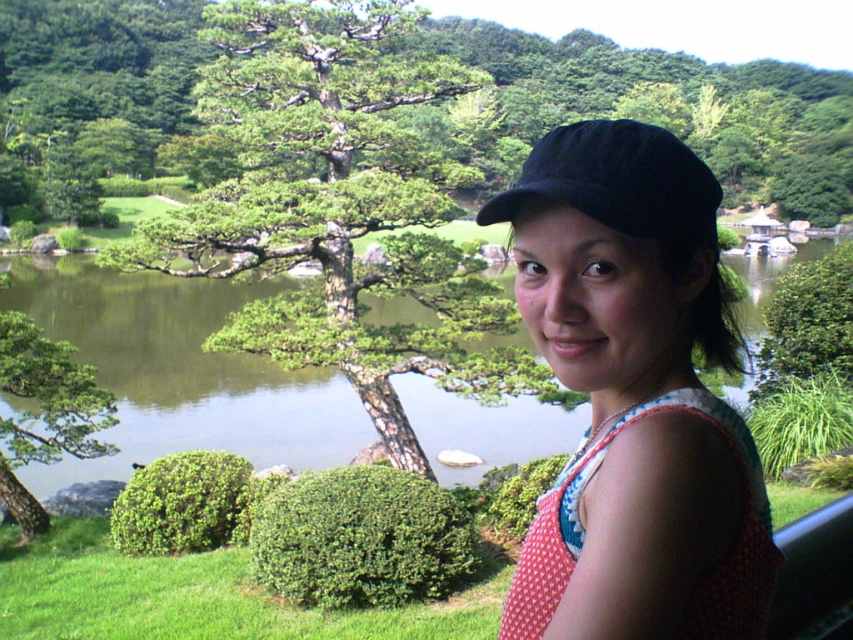
Can you confirm if matte black cap at upper right is positioned to the right of polka dot fabric apron at right?

Yes, matte black cap at upper right is to the right of polka dot fabric apron at right.

Is point (584, 520) in front of point (758, 506)?

Yes, point (584, 520) is closer to viewer.

Where is `matte black cap at upper right`? The image size is (853, 640). matte black cap at upper right is located at coordinates (634, 397).

Is matte black cap at upper right bigger than green leafy tree at center?

Incorrect, matte black cap at upper right is not larger than green leafy tree at center.

Who is shorter, matte black cap at upper right or green leafy tree at center?

matte black cap at upper right is shorter.

Who is more forward, (547,573) or (479,138)?

Point (547,573) is more forward.

The height and width of the screenshot is (640, 853). In order to click on matte black cap at upper right in this screenshot , I will do click(634, 397).

Between matte black cap at upper right and green textured tree at center, which one has less height?

matte black cap at upper right is shorter.

Is matte black cap at upper right thinner than green textured tree at center?

Indeed, matte black cap at upper right has a lesser width compared to green textured tree at center.

Find the location of `matte black cap at upper right`. matte black cap at upper right is located at coordinates (634, 397).